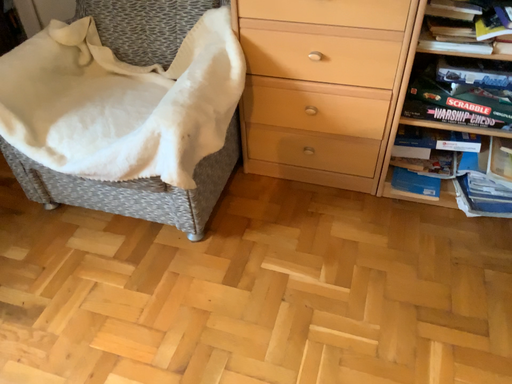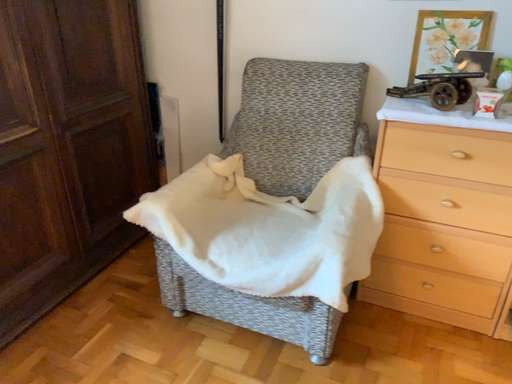
Question: How did the camera likely rotate when shooting the video?

Choices:
 (A) rotated downward
 (B) rotated upward

Answer: (B)